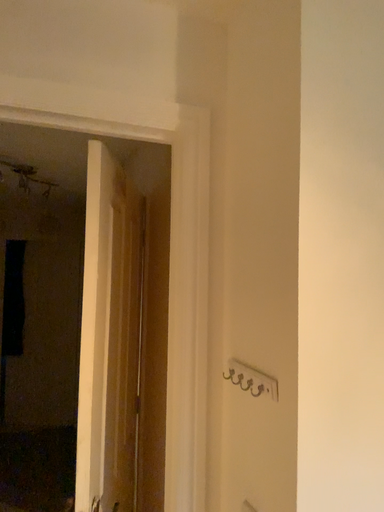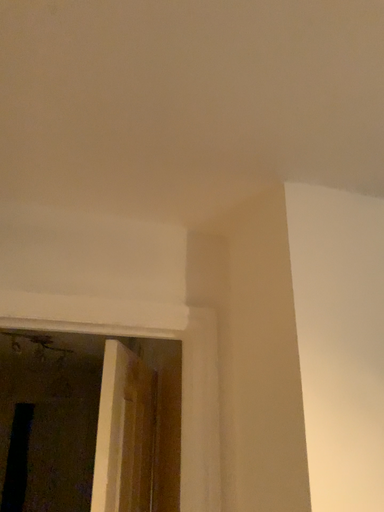
Question: Which way did the camera rotate in the video?

Choices:
 (A) rotated upward
 (B) rotated downward

Answer: (A)